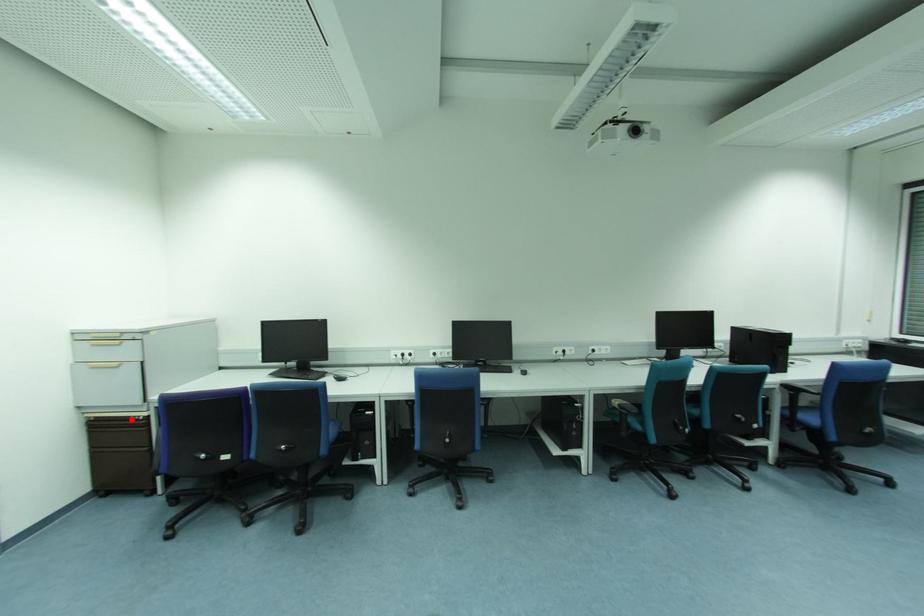
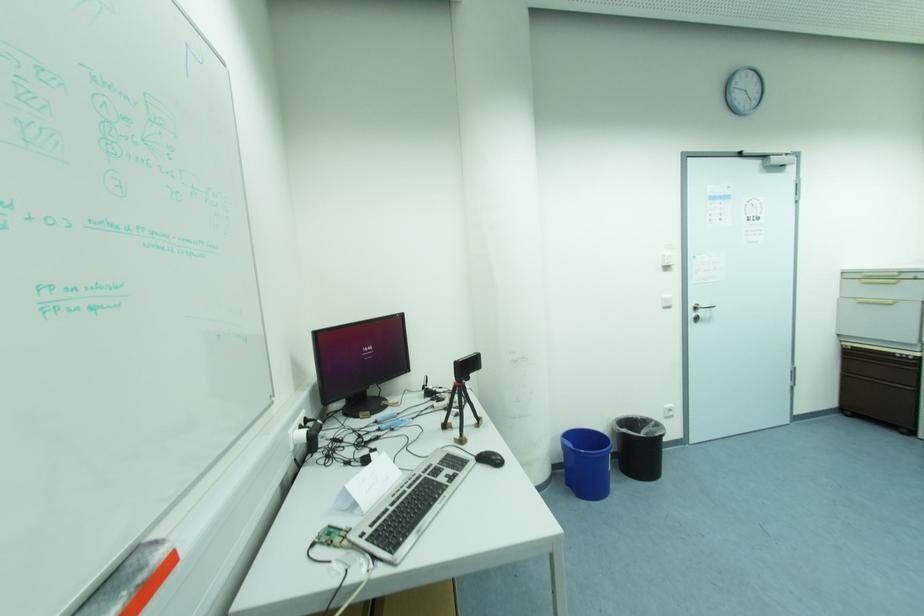
Question: I am providing you with two images of the same scene from different viewpoints. A red point is shown in image1. For the corresponding object point in image2, is it positioned nearer or farther from the camera?

Choices:
 (A) Nearer
 (B) Farther

Answer: (B)